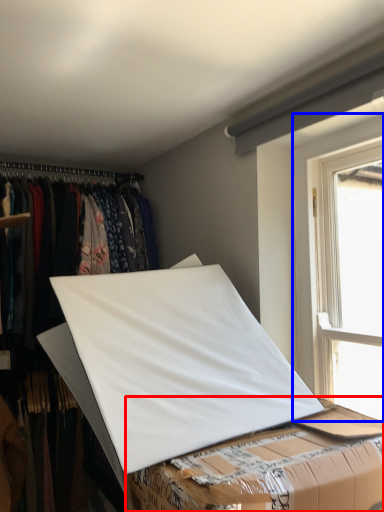
Question: Which point is further to the camera, table (highlighted by a red box) or window (highlighted by a blue box)?

Choices:
 (A) table
 (B) window

Answer: (B)